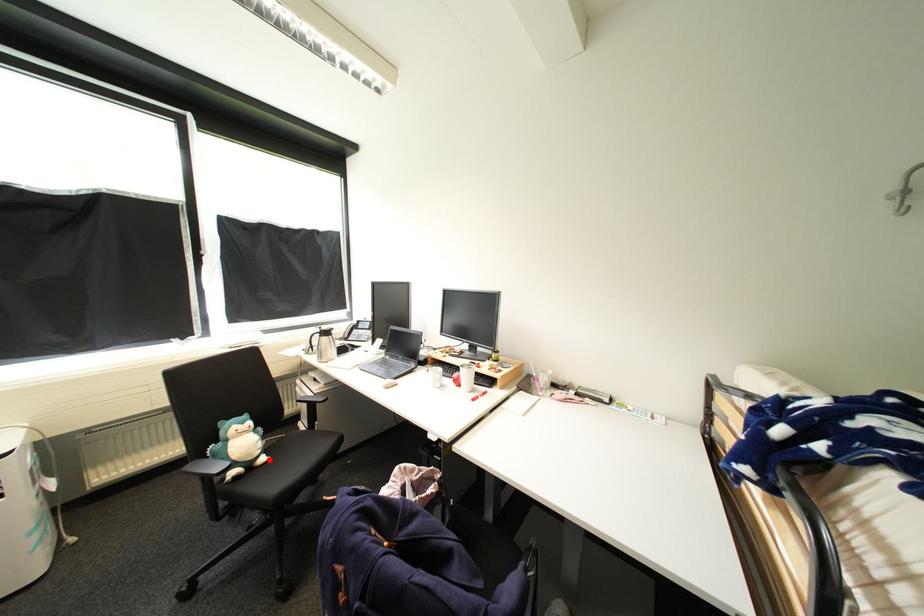
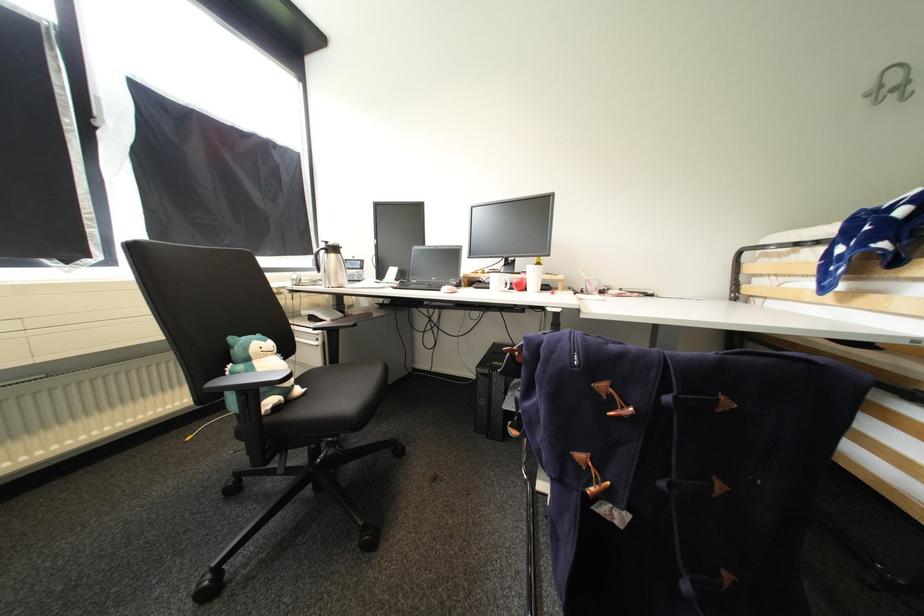
Question: A red point is marked in image1. In image2, is the corresponding 3D point closer to the camera or farther? Reply with the corresponding letter.

Choices:
 (A) The corresponding 3D point is closer.
 (B) The corresponding 3D point is farther.

Answer: (B)